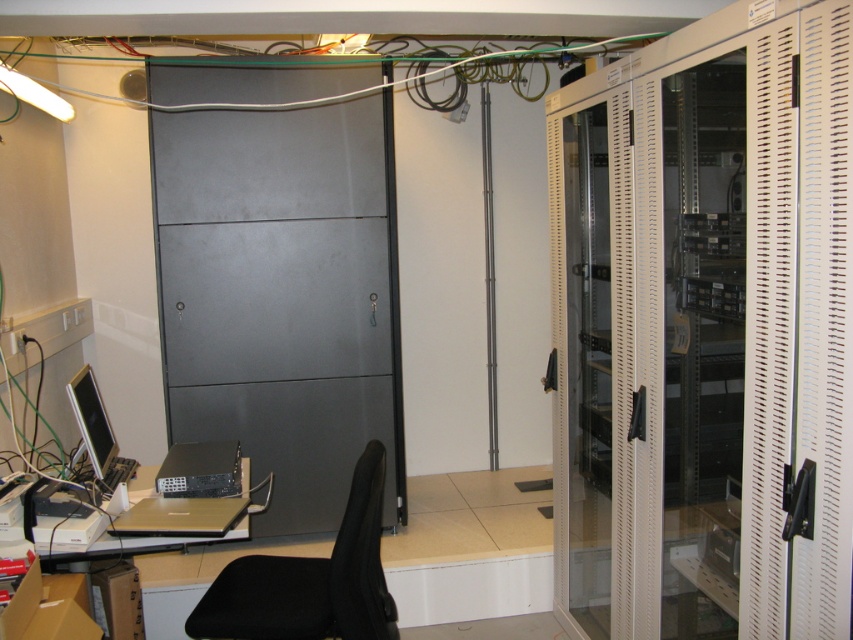
You are standing at the desk with the black office chair and want to access the beige perforated locker at right. Based on the 2D coordinates provided, is the locker to your left or right side?

The beige perforated locker at right is located at coordinates (x=706, y=330). Since the coordinate system typically places (x=0, y=0) at the bottom left corner, 0.517 on the x axis would be to the right of the center point. Therefore, the locker is to your right side.

You are a technician who needs to access the beige perforated locker at right. You are currently standing 1.5 meters away from it. Can you reach the locker without moving closer?

The beige perforated locker at right is 1.40 meters away from camera. Since you are standing 1.5 meters away from it, you are slightly farther than the locker is from the camera. Therefore, you need to move closer to reach it.

You are standing at the desk and need to access the beige perforated locker at right. Based on the coordinates provided, is the locker located to your left or right side?

The beige perforated locker at right is located at coordinates point (706, 330), which places it to your right side relative to your position at the desk.